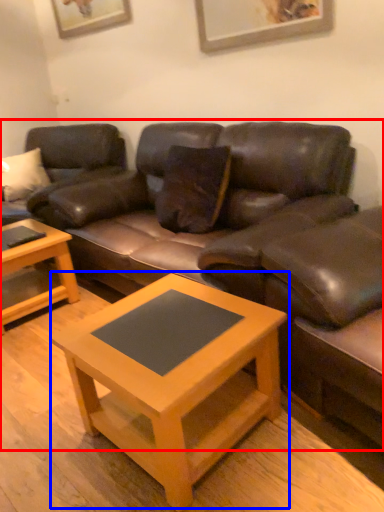
Question: Which object appears farthest to the camera in this image, studio couch (highlighted by a red box) or coffee table (highlighted by a blue box)?

Choices:
 (A) studio couch
 (B) coffee table

Answer: (A)